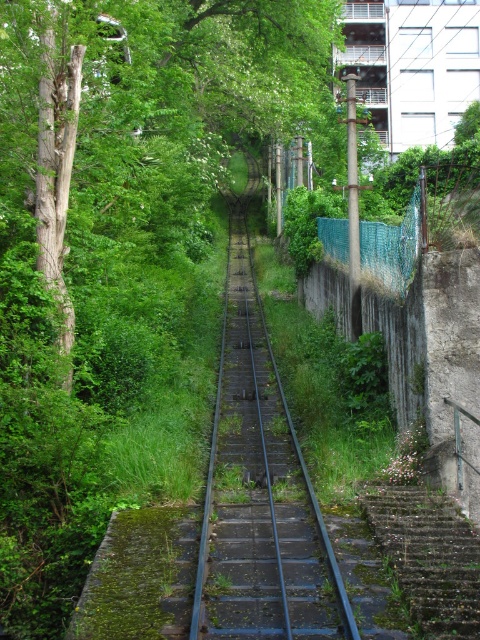
Locate an element on the screen. This screenshot has height=640, width=480. green leafy tree at upper left is located at coordinates (137, 148).

Is the position of green leafy tree at upper left less distant than that of mossy concrete stairs at lower right?

No, green leafy tree at upper left is behind mossy concrete stairs at lower right.

Does point (226, 44) come behind point (406, 586)?

That is True.

Where is `green leafy tree at upper left`? Image resolution: width=480 pixels, height=640 pixels. green leafy tree at upper left is located at coordinates (137, 148).

Is green leafy tree at upper left further to camera compared to rusty metal train track at center?

Yes, it is behind rusty metal train track at center.

Is point (267, 108) less distant than point (265, 403)?

That is False.

Between point (168, 228) and point (219, 538), which one is positioned in front?

Point (219, 538) is more forward.

In order to click on green leafy tree at upper left in this screenshot , I will do `click(137, 148)`.

Is rusty metal train track at center bigger than mossy concrete stairs at lower right?

Indeed, rusty metal train track at center has a larger size compared to mossy concrete stairs at lower right.

From the picture: Can you confirm if rusty metal train track at center is positioned above mossy concrete stairs at lower right?

Indeed, rusty metal train track at center is positioned over mossy concrete stairs at lower right.

The height and width of the screenshot is (640, 480). Identify the location of rusty metal train track at center. (260, 490).

I want to click on rusty metal train track at center, so click(260, 490).